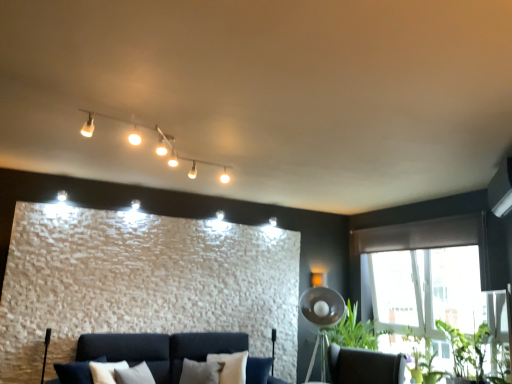
Question: From a real-world perspective, is dark brown leather swivel chair at lower right positioned under green leafy plant at lower right, which is the first plant from front to back, based on gravity?

Choices:
 (A) yes
 (B) no

Answer: (A)

Question: Can you confirm if dark brown leather swivel chair at lower right is positioned to the left of green leafy plant at lower right, which is the first plant from front to back?

Choices:
 (A) yes
 (B) no

Answer: (A)

Question: Is dark brown leather swivel chair at lower right aimed at green leafy plant at lower right, the second plant in the back-to-front sequence?

Choices:
 (A) no
 (B) yes

Answer: (A)

Question: Is dark brown leather swivel chair at lower right far away from green leafy plant at lower right, the second plant in the back-to-front sequence?

Choices:
 (A) no
 (B) yes

Answer: (A)

Question: Can you confirm if dark brown leather swivel chair at lower right is smaller than green leafy plant at lower right, the second plant in the back-to-front sequence?

Choices:
 (A) no
 (B) yes

Answer: (A)

Question: Is point (474, 370) positioned closer to the camera than point (315, 342)?

Choices:
 (A) farther
 (B) closer

Answer: (B)

Question: Is green leafy plant at lower right, the second plant in the back-to-front sequence, taller or shorter than metallic silver tripod lamp at lower right?

Choices:
 (A) tall
 (B) short

Answer: (B)

Question: Is green leafy plant at lower right, which is the first plant from front to back, inside or outside of metallic silver tripod lamp at lower right?

Choices:
 (A) outside
 (B) inside

Answer: (A)

Question: From the image's perspective, is green leafy plant at lower right, the second plant in the back-to-front sequence, located above or below metallic silver tripod lamp at lower right?

Choices:
 (A) below
 (B) above

Answer: (B)

Question: Considering the positions of dark brown leather swivel chair at lower right and metallic silver tripod lamp at lower right in the image, is dark brown leather swivel chair at lower right bigger or smaller than metallic silver tripod lamp at lower right?

Choices:
 (A) big
 (B) small

Answer: (A)

Question: From a real-world perspective, is dark brown leather swivel chair at lower right above or below metallic silver tripod lamp at lower right?

Choices:
 (A) below
 (B) above

Answer: (A)

Question: Is dark brown leather swivel chair at lower right taller or shorter than metallic silver tripod lamp at lower right?

Choices:
 (A) short
 (B) tall

Answer: (A)

Question: Considering the relative positions of dark brown leather swivel chair at lower right and metallic silver tripod lamp at lower right in the image provided, is dark brown leather swivel chair at lower right to the left or to the right of metallic silver tripod lamp at lower right?

Choices:
 (A) right
 (B) left

Answer: (A)

Question: Is point (440, 243) positioned closer to the camera than point (322, 304)?

Choices:
 (A) farther
 (B) closer

Answer: (B)

Question: Relative to metallic silver tripod lamp at lower right, is brown fabric curtain at upper right in front or behind?

Choices:
 (A) front
 (B) behind

Answer: (A)